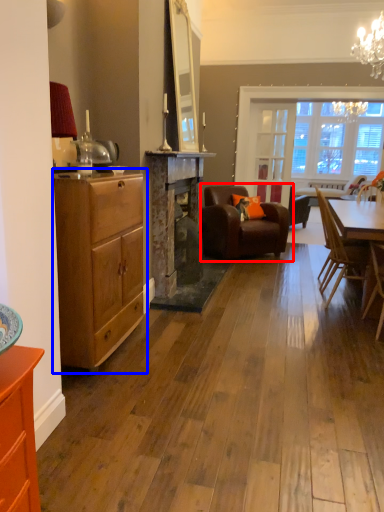
Question: Among these objects, which one is nearest to the camera, chair (highlighted by a red box) or chest of drawers (highlighted by a blue box)?

Choices:
 (A) chair
 (B) chest of drawers

Answer: (B)